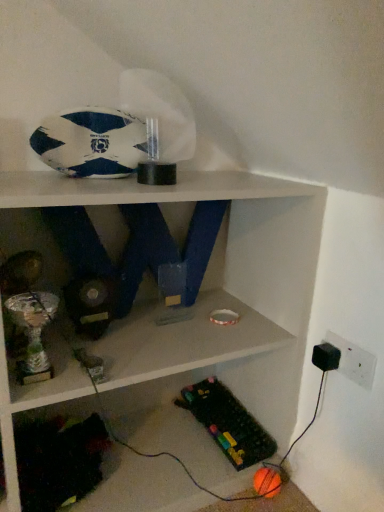
Question: Should I look upward or downward to see white and blue textured rugby ball at upper left?

Choices:
 (A) up
 (B) down

Answer: (A)